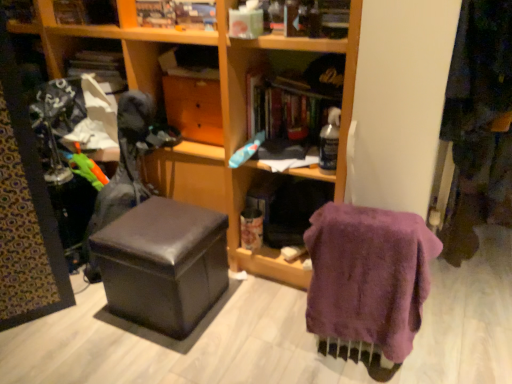
Question: In which direction should I rotate to look at matte cardboard book at upper center, the 3th book in the left-to-right sequence?

Choices:
 (A) left
 (B) right

Answer: (A)

Question: Can you confirm if hardcover book at center, acting as the first book starting from the right, is smaller than wooden bookshelf at upper center?

Choices:
 (A) yes
 (B) no

Answer: (B)

Question: Is hardcover book at center, the fourth book in the left-to-right sequence, positioned in front of wooden bookshelf at upper center?

Choices:
 (A) no
 (B) yes

Answer: (B)

Question: Could you tell me if hardcover book at center, the fourth book in the left-to-right sequence, is facing wooden bookshelf at upper center?

Choices:
 (A) no
 (B) yes

Answer: (A)

Question: From the image's perspective, is hardcover book at center, the fourth book in the left-to-right sequence, located above wooden bookshelf at upper center?

Choices:
 (A) yes
 (B) no

Answer: (B)

Question: From a real-world perspective, does hardcover book at center, the fourth book in the left-to-right sequence, stand above wooden bookshelf at upper center?

Choices:
 (A) yes
 (B) no

Answer: (B)

Question: Are hardcover book at center, acting as the first book starting from the right, and wooden bookshelf at upper center far apart?

Choices:
 (A) no
 (B) yes

Answer: (B)

Question: Is matte black ottoman at center positioned with its back to wooden drawer at center?

Choices:
 (A) no
 (B) yes

Answer: (B)

Question: Is matte black ottoman at center oriented towards wooden drawer at center?

Choices:
 (A) yes
 (B) no

Answer: (A)

Question: Can you confirm if matte black ottoman at center is smaller than wooden drawer at center?

Choices:
 (A) no
 (B) yes

Answer: (A)

Question: Is matte black ottoman at center far away from wooden drawer at center?

Choices:
 (A) yes
 (B) no

Answer: (B)

Question: Can you confirm if matte black ottoman at center is bigger than wooden drawer at center?

Choices:
 (A) yes
 (B) no

Answer: (A)

Question: Does matte black ottoman at center have a greater height compared to wooden drawer at center?

Choices:
 (A) no
 (B) yes

Answer: (B)

Question: Is hardcover book at center, acting as the first book starting from the right, oriented away from wooden drawer at center?

Choices:
 (A) no
 (B) yes

Answer: (A)